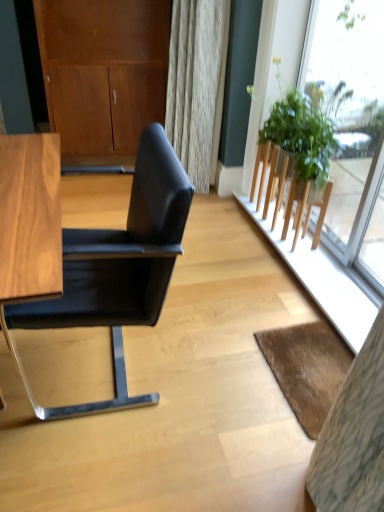
The width and height of the screenshot is (384, 512). In order to click on vacant space in black leather chair at left (from a real-world perspective) in this screenshot , I will do `click(94, 362)`.